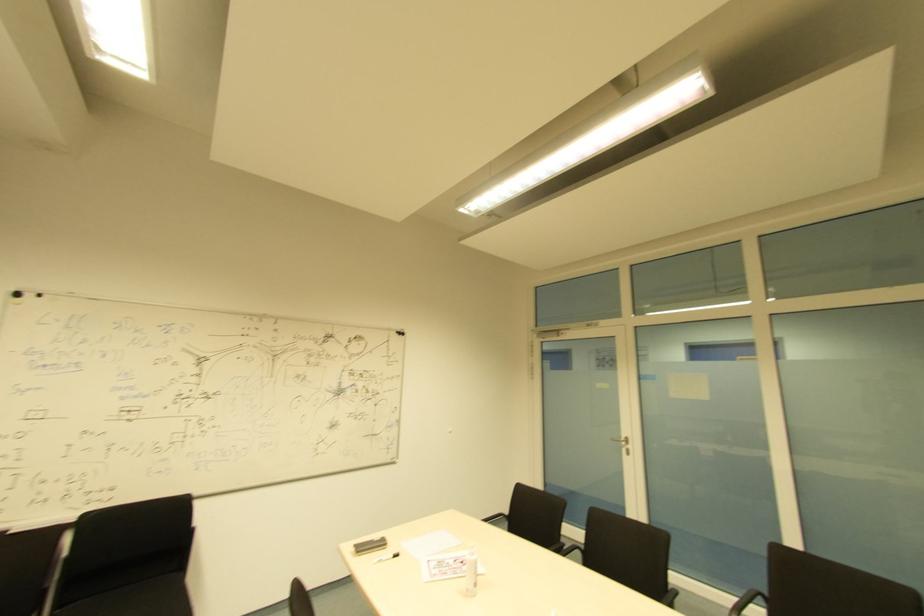
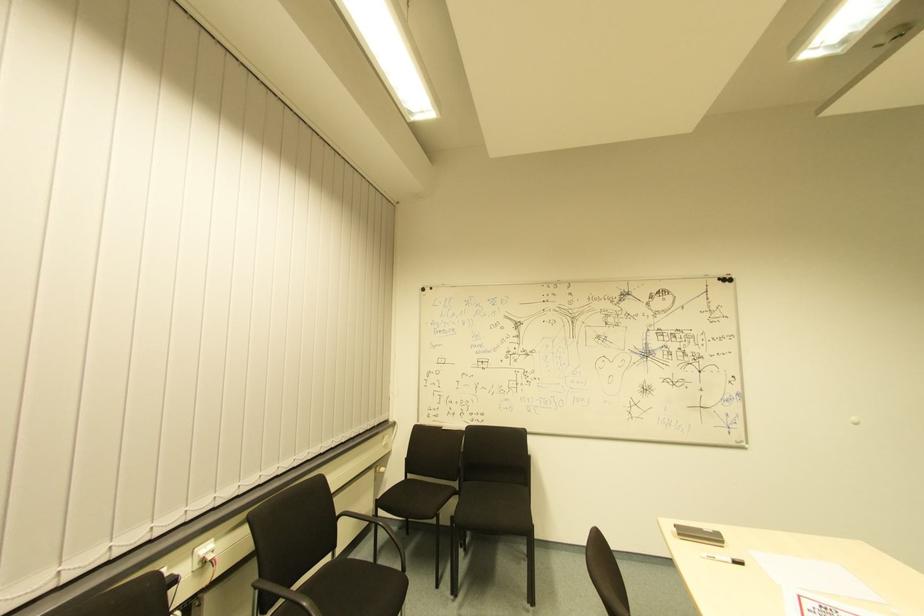
In the second image, find the point that corresponds to (398,339) in the first image.

(725, 286)